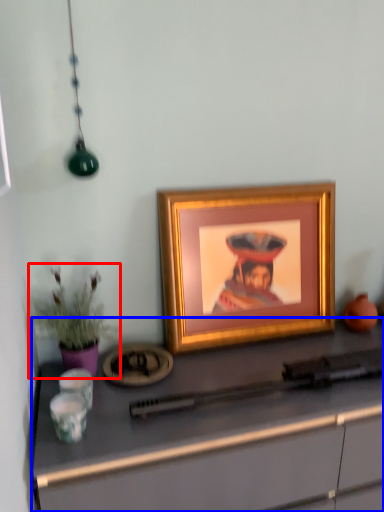
Question: Which of the following is the farthest to the observer, houseplant (highlighted by a red box) or desk (highlighted by a blue box)?

Choices:
 (A) houseplant
 (B) desk

Answer: (A)